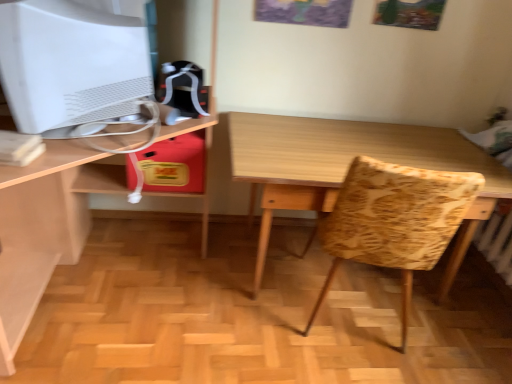
Find the location of a particular element. Image resolution: width=512 pixels, height=384 pixels. wooden table at center is located at coordinates (347, 168).

What are the coordinates of `wooden desk at center` in the screenshot? It's located at (45, 227).

I want to click on wooden table at center, so click(x=347, y=168).

Is wooden desk at center aimed at wooden table at center?

No, wooden desk at center is not oriented towards wooden table at center.

In the scene shown: Which object is positioned more to the left, wooden desk at center or wooden table at center?

Positioned to the left is wooden desk at center.

This screenshot has width=512, height=384. Find the location of `desk on the left side of wooden table at center`. desk on the left side of wooden table at center is located at coordinates (45, 227).

From a real-world perspective, which object rests below the other?

wooden table at center, from a real-world perspective.

Based on the photo, which of these two, wooden desk at center or white matte computer monitor at upper left, stands taller?

wooden desk at center.

In the image, there is a wooden desk at center. What are the coordinates of `computer monitor above it (from the image's perspective)` in the screenshot? It's located at (70, 64).

Which object is further away from the camera, wooden desk at center or white matte computer monitor at upper left?

Positioned behind is white matte computer monitor at upper left.

Does wooden desk at center have a greater width compared to white matte computer monitor at upper left?

Correct, the width of wooden desk at center exceeds that of white matte computer monitor at upper left.

From the image's perspective, is patterned fabric swivel chair at center above or below white matte computer monitor at upper left?

From the image's perspective, patterned fabric swivel chair at center appears below white matte computer monitor at upper left.

Considering the relative positions of patterned fabric swivel chair at center and white matte computer monitor at upper left in the image provided, is patterned fabric swivel chair at center to the left of white matte computer monitor at upper left from the viewer's perspective?

In fact, patterned fabric swivel chair at center is to the right of white matte computer monitor at upper left.

Do you think patterned fabric swivel chair at center is within white matte computer monitor at upper left, or outside of it?

patterned fabric swivel chair at center is located beyond the bounds of white matte computer monitor at upper left.

How different are the orientations of patterned fabric swivel chair at center and white matte computer monitor at upper left in degrees?

116 degrees separate the facing orientations of patterned fabric swivel chair at center and white matte computer monitor at upper left.

Who is shorter, patterned fabric swivel chair at center or wooden table at center?

With less height is wooden table at center.

Considering the positions of objects patterned fabric swivel chair at center and wooden table at center in the image provided, who is in front, patterned fabric swivel chair at center or wooden table at center?

patterned fabric swivel chair at center.

From a real-world perspective, is patterned fabric swivel chair at center above or below wooden table at center?

In terms of real-world spatial position, patterned fabric swivel chair at center is above wooden table at center.

Are patterned fabric swivel chair at center and wooden table at center beside each other?

patterned fabric swivel chair at center and wooden table at center are not in contact.

Considering the relative sizes of white matte computer monitor at upper left and wooden desk at center in the image provided, is white matte computer monitor at upper left taller than wooden desk at center?

No.

Between white matte computer monitor at upper left and wooden desk at center, which one appears on the right side from the viewer's perspective?

Positioned to the right is white matte computer monitor at upper left.

Consider the image. How far apart are white matte computer monitor at upper left and wooden desk at center?

white matte computer monitor at upper left is 24.16 inches away from wooden desk at center.

Between point (0, 37) and point (20, 195), which one is positioned behind?

Positioned behind is point (20, 195).

Consider the image. Is white matte computer monitor at upper left next to patterned fabric swivel chair at center?

white matte computer monitor at upper left is not next to patterned fabric swivel chair at center, and they're not touching.

Is point (53, 69) positioned after point (328, 288)?

No, (53, 69) is in front of (328, 288).

Locate an element on the screen. This screenshot has height=384, width=512. swivel chair behind the white matte computer monitor at upper left is located at coordinates (395, 221).

From the image's perspective, between white matte computer monitor at upper left and patterned fabric swivel chair at center, which one is located above?

From the image's view, white matte computer monitor at upper left is above.

From a real-world perspective, is wooden table at center located beneath wooden desk at center?

Correct, in the physical world, wooden table at center is lower than wooden desk at center.

Would you say wooden table at center is outside wooden desk at center?

Yes, wooden table at center is outside of wooden desk at center.

Where is `table to the right of wooden desk at center`? table to the right of wooden desk at center is located at coordinates (347, 168).

Does point (420, 149) appear closer or farther from the camera than point (63, 243)?

Point (420, 149).

This screenshot has height=384, width=512. In order to click on desk above the wooden table at center (from a real-world perspective) in this screenshot , I will do `click(45, 227)`.

The height and width of the screenshot is (384, 512). Find the location of `desk on the left side of white matte computer monitor at upper left`. desk on the left side of white matte computer monitor at upper left is located at coordinates (45, 227).

Looking at the image, which one is located closer to white matte computer monitor at upper left, wooden table at center or wooden desk at center?

wooden desk at center is positioned closer to the anchor white matte computer monitor at upper left.

Looking at the image, which one is located closer to patterned fabric swivel chair at center, wooden desk at center or wooden table at center?

wooden table at center.

From the picture: Looking at the image, which one is located closer to wooden desk at center, wooden table at center or patterned fabric swivel chair at center?

Among the two, wooden table at center is located nearer to wooden desk at center.

When comparing their distances from patterned fabric swivel chair at center, does wooden desk at center or white matte computer monitor at upper left seem further?

The object further to patterned fabric swivel chair at center is wooden desk at center.

From the picture: When comparing their distances from wooden table at center, does white matte computer monitor at upper left or patterned fabric swivel chair at center seem further?

Among the two, white matte computer monitor at upper left is located further to wooden table at center.

Consider the image. Based on their spatial positions, is patterned fabric swivel chair at center or wooden desk at center closer to wooden table at center?

patterned fabric swivel chair at center is positioned closer to the anchor wooden table at center.

Estimate the real-world distances between objects in this image. Which object is closer to white matte computer monitor at upper left, wooden desk at center or wooden table at center?

Among the two, wooden desk at center is located nearer to white matte computer monitor at upper left.

Based on their spatial positions, is white matte computer monitor at upper left or wooden desk at center further from patterned fabric swivel chair at center?

wooden desk at center.

Image resolution: width=512 pixels, height=384 pixels. Identify the location of table situated between white matte computer monitor at upper left and patterned fabric swivel chair at center from left to right. (347, 168).

Identify the location of table between wooden desk at center and patterned fabric swivel chair at center in the horizontal direction. (347, 168).

Locate an element on the screen. computer monitor between wooden desk at center and wooden table at center from left to right is located at coordinates (70, 64).

Identify the location of computer monitor situated between wooden desk at center and patterned fabric swivel chair at center from left to right. Image resolution: width=512 pixels, height=384 pixels. (70, 64).